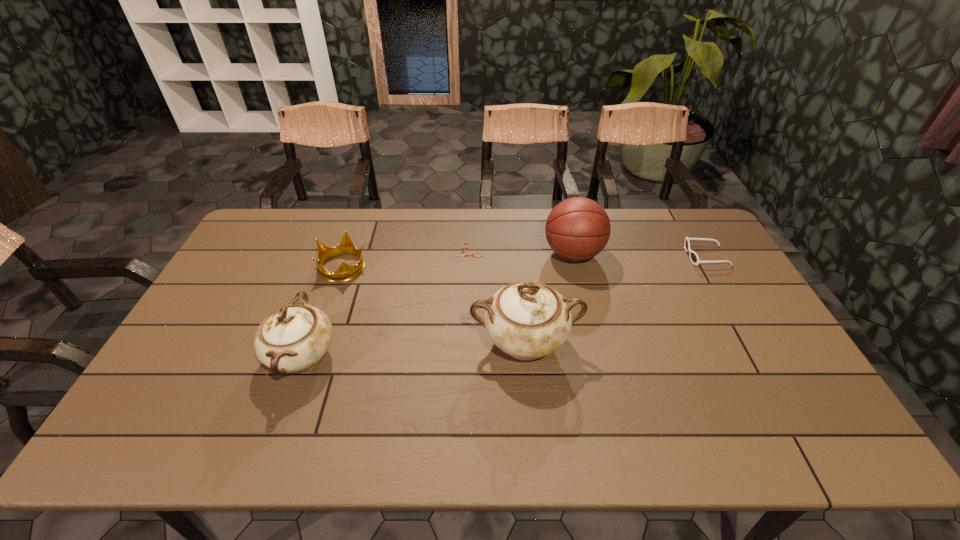
This screenshot has width=960, height=540. I want to click on vacant space that satisfies the following two spatial constraints: 1. on the back side of the basketball; 2. on the left side of the right chinaware, so click(x=516, y=254).

At what (x,y) coordinates should I click in order to perform the action: click on vacant area in the image that satisfies the following two spatial constraints: 1. with the lenses of the rightmost object facing outward; 2. on the front side of the right chinaware. Please return your answer as a coordinate pair (x, y). Looking at the image, I should click on (756, 342).